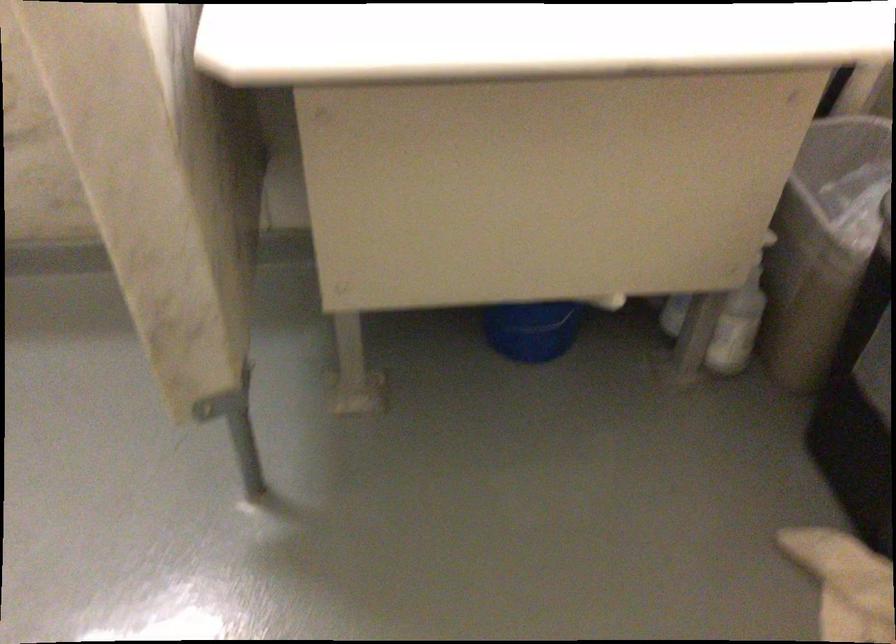
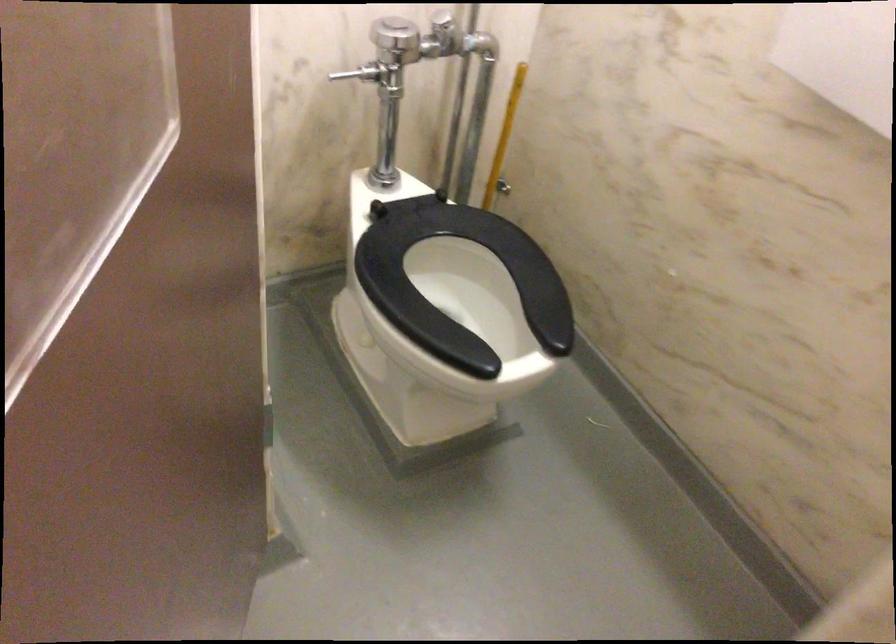
Question: The images are taken continuously from a first-person perspective. In which direction is your viewpoint rotating?

Choices:
 (A) Left
 (B) Right
 (C) Up
 (D) Down

Answer: (A)